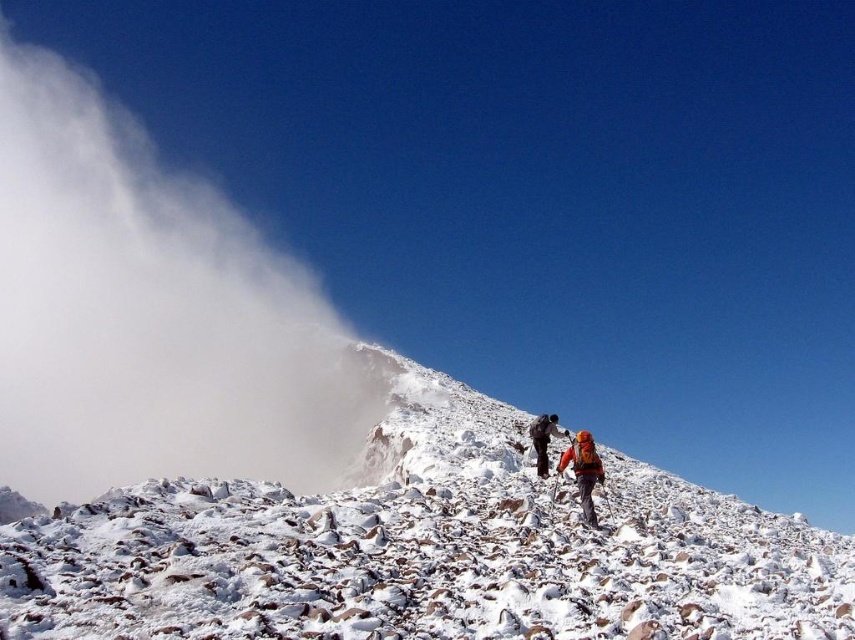
Is point (505, 413) positioned after point (541, 424)?

Yes, point (505, 413) is farther from viewer.

Is white rocky mountain at center smaller than orange fabric jacket at center?

Actually, white rocky mountain at center might be larger than orange fabric jacket at center.

Where is `white rocky mountain at center`? The width and height of the screenshot is (855, 640). white rocky mountain at center is located at coordinates (423, 548).

Where is `white rocky mountain at center`? white rocky mountain at center is located at coordinates (423, 548).

Can you confirm if orange fabric backpack at center is positioned to the left of orange fabric jacket at center?

Incorrect, orange fabric backpack at center is not on the left side of orange fabric jacket at center.

Is orange fabric backpack at center above orange fabric jacket at center?

Correct, orange fabric backpack at center is located above orange fabric jacket at center.

Which is in front, point (593, 486) or point (534, 442)?

Positioned in front is point (593, 486).

Where is `orange fabric backpack at center`? The height and width of the screenshot is (640, 855). orange fabric backpack at center is located at coordinates (582, 470).

Can you confirm if white fluffy cloud at upper left is taller than orange fabric backpack at center?

Yes, white fluffy cloud at upper left is taller than orange fabric backpack at center.

Is white fluffy cloud at upper left above orange fabric backpack at center?

Correct, white fluffy cloud at upper left is located above orange fabric backpack at center.

Identify the location of white fluffy cloud at upper left. (152, 316).